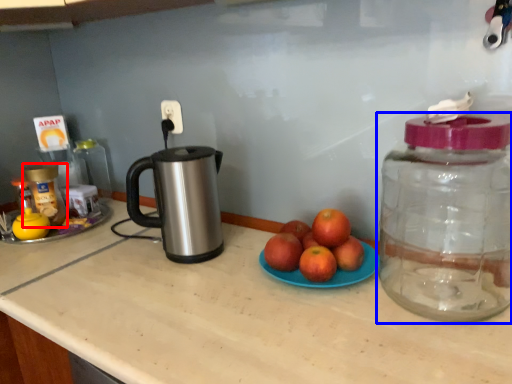
Question: Which object is further to the camera taking this photo, bottle (highlighted by a red box) or bottle (highlighted by a blue box)?

Choices:
 (A) bottle
 (B) bottle

Answer: (A)